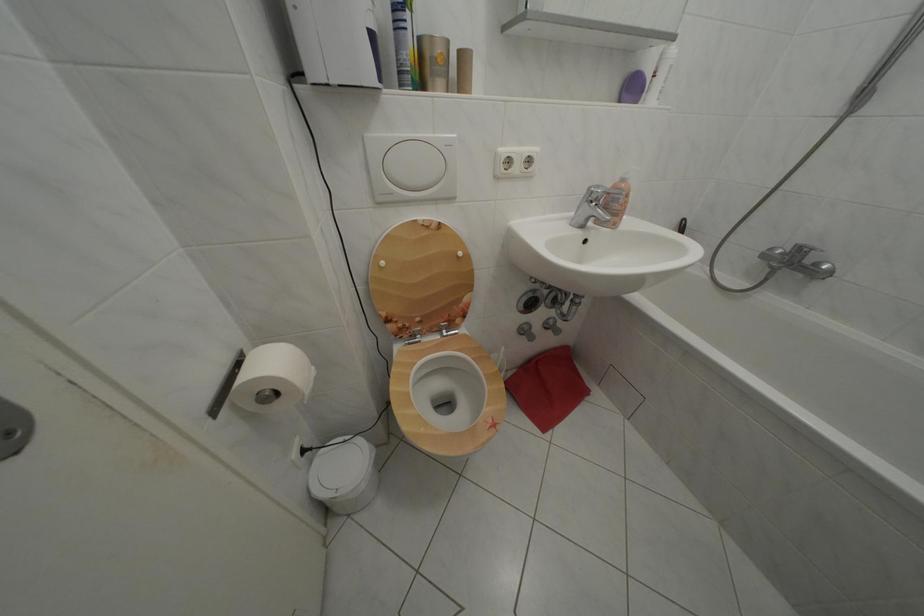
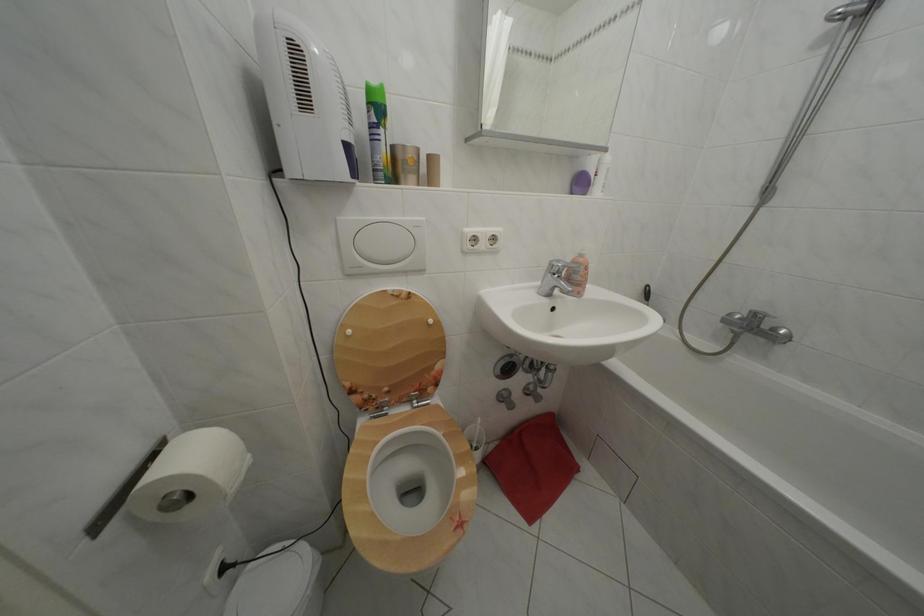
Find the pixel in the second image that matches (x=392, y=269) in the first image.

(358, 338)